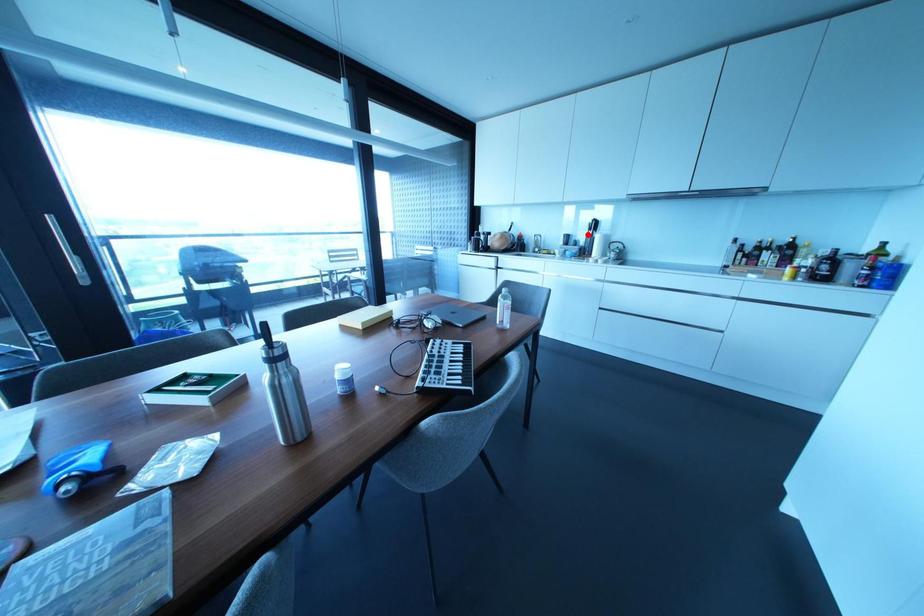
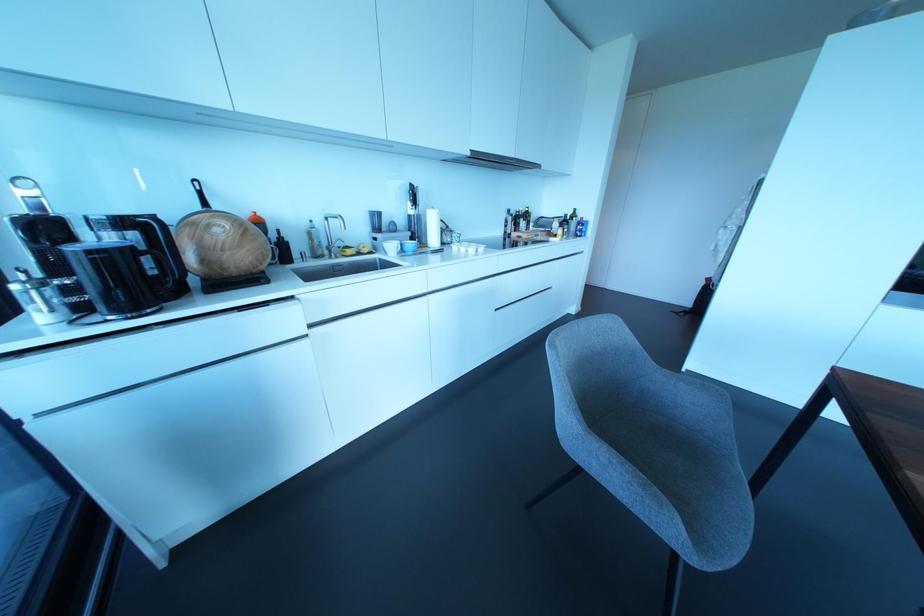
Find the pixel in the second image that matches the highlighted location in the first image.

(410, 211)